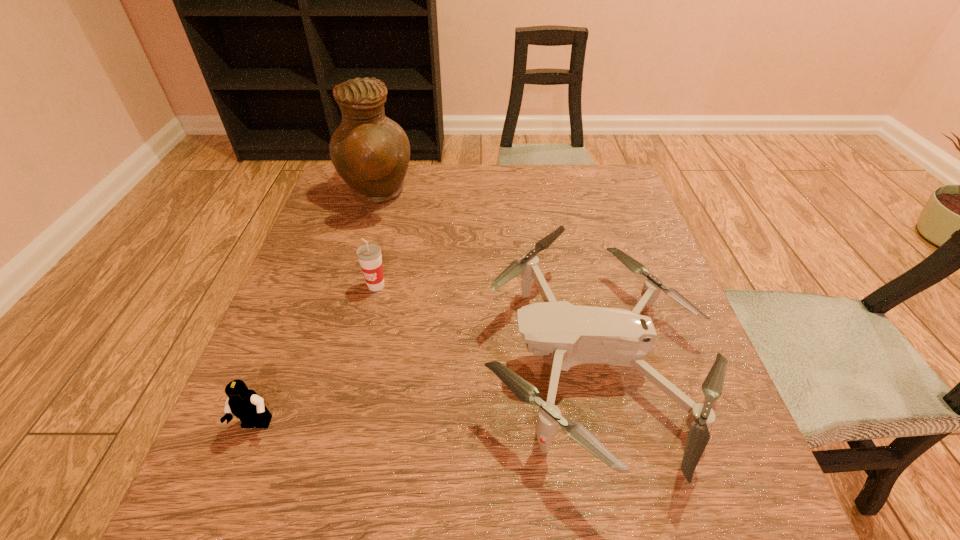
I want to click on blank area in the image that satisfies the following two spatial constraints: 1. with a camera at the front of the drone; 2. on the front-facing side of the Lego, so click(x=609, y=425).

Find the location of a particular element. vacant point that satisfies the following two spatial constraints: 1. at the spout of the pitcher; 2. on the front-facing side of the Lego is located at coordinates (307, 425).

You are a GUI agent. You are given a task and a screenshot of the screen. Output one action in this format:
    pyautogui.click(x=<x>, y=<y>)
    Task: Click on the free spot that satisfies the following two spatial constraints: 1. at the spout of the tallest object; 2. on the front-facing side of the Lego
    
    Given the screenshot: What is the action you would take?
    pyautogui.click(x=307, y=425)